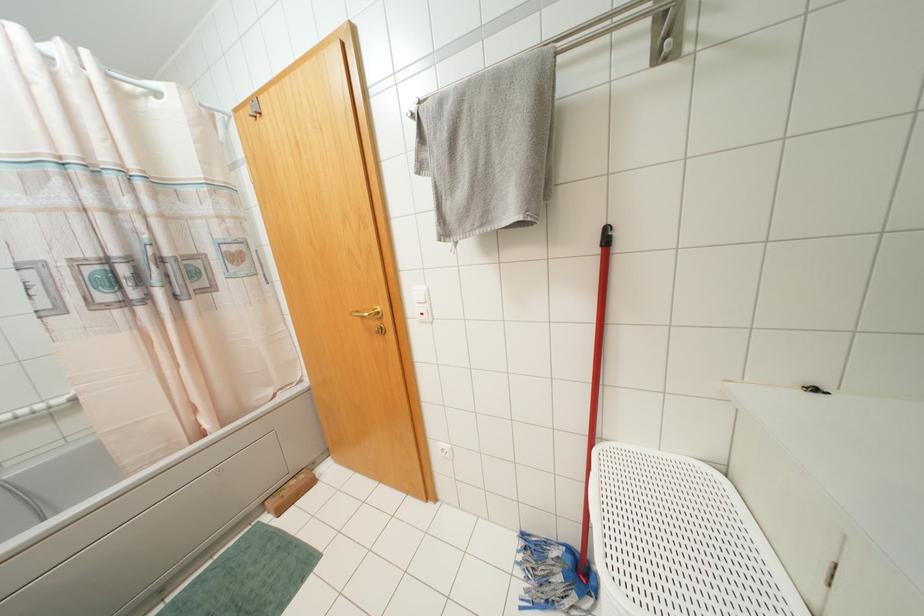
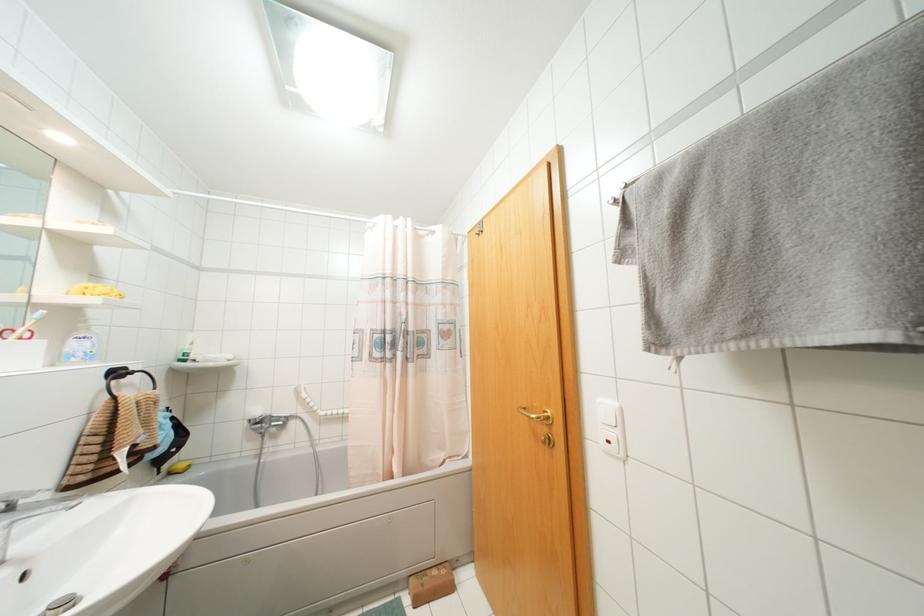
Where in the second image is the point corresponding to (x=378, y=312) from the first image?

(546, 416)